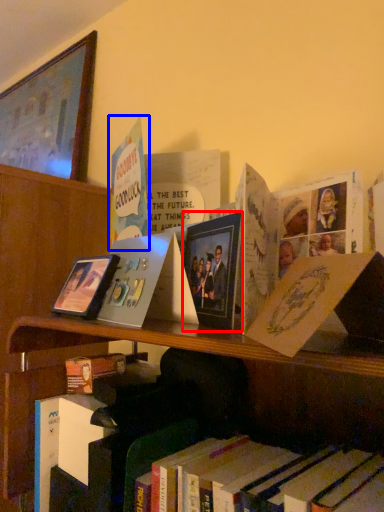
Question: Which of the following is the farthest to the observer, picture frame (highlighted by a red box) or book (highlighted by a blue box)?

Choices:
 (A) picture frame
 (B) book

Answer: (B)